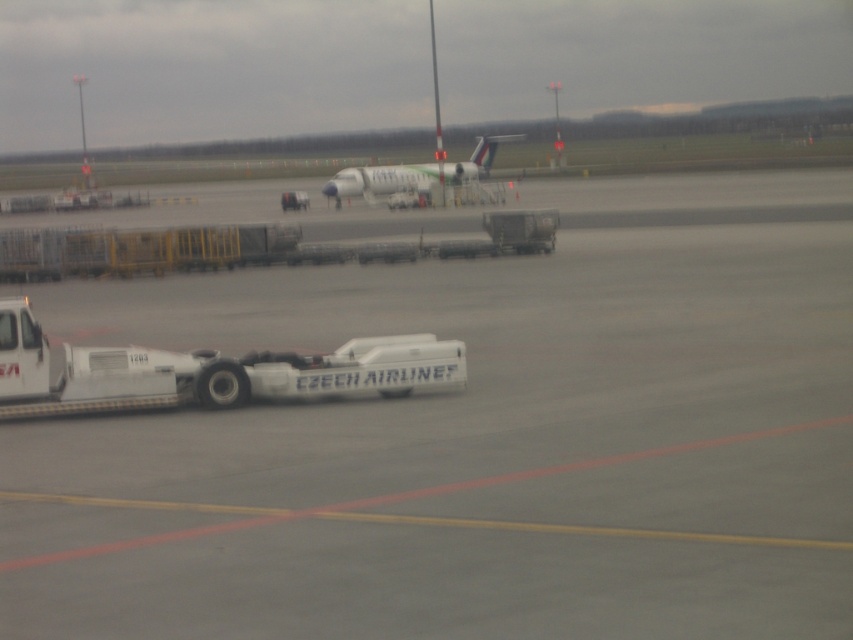
Is white matte tow truck at lower left below white glossy airplane at center?

Yes.

From the picture: Which of these two, white matte tow truck at lower left or white glossy airplane at center, stands shorter?

Standing shorter between the two is white matte tow truck at lower left.

Is point (416, 378) positioned behind point (461, 172)?

No, it is not.

Where is `white matte tow truck at lower left`? This screenshot has width=853, height=640. white matte tow truck at lower left is located at coordinates (206, 371).

This screenshot has width=853, height=640. What do you see at coordinates (479, 440) in the screenshot?
I see `white rubber tarmac at center` at bounding box center [479, 440].

Does point (349, 492) come closer to viewer compared to point (479, 161)?

Yes.

The image size is (853, 640). In order to click on white rubber tarmac at center in this screenshot , I will do `click(479, 440)`.

Does white rubber tarmac at center have a greater width compared to white matte tow truck at lower left?

Correct, the width of white rubber tarmac at center exceeds that of white matte tow truck at lower left.

Which is more to the left, white rubber tarmac at center or white matte tow truck at lower left?

From the viewer's perspective, white matte tow truck at lower left appears more on the left side.

Locate an element on the screen. Image resolution: width=853 pixels, height=640 pixels. white rubber tarmac at center is located at coordinates (479, 440).